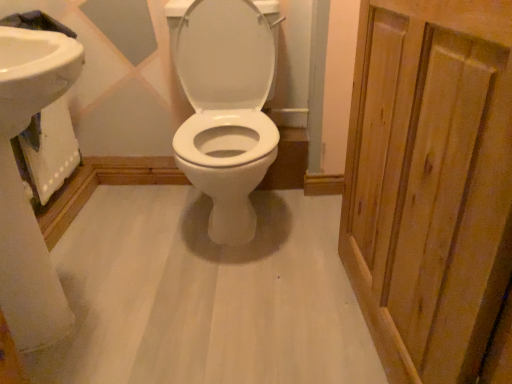
Question: Does point (220, 28) appear closer or farther from the camera than point (31, 281)?

Choices:
 (A) closer
 (B) farther

Answer: (B)

Question: Is white glossy toilet at center taller or shorter than white glossy sink at left?

Choices:
 (A) tall
 (B) short

Answer: (A)

Question: Estimate the real-world distances between objects in this image. Which object is closer to the white glossy toilet at center?

Choices:
 (A) white glossy sink at left
 (B) natural wood screen door at right

Answer: (B)

Question: Which object is positioned closest to the white glossy sink at left?

Choices:
 (A) natural wood screen door at right
 (B) white glossy toilet at center

Answer: (B)